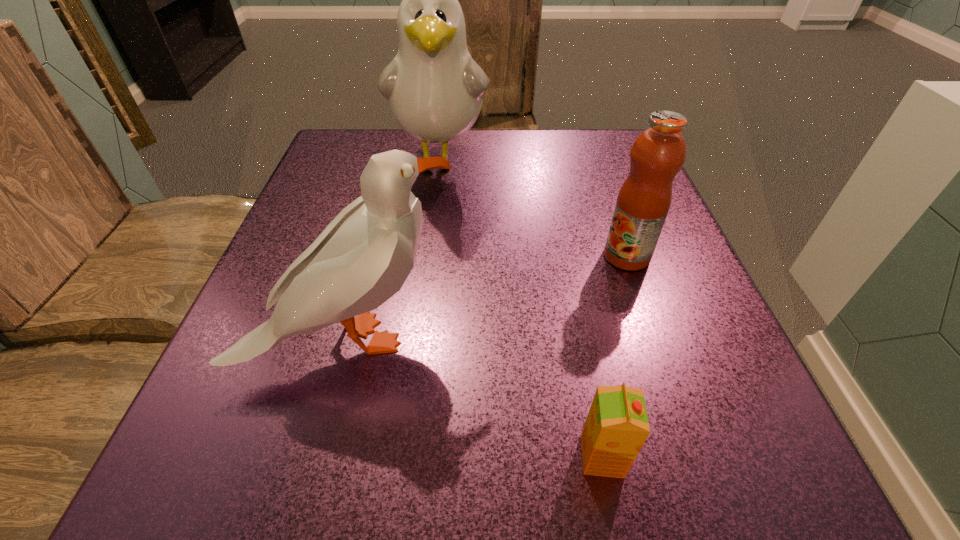
This screenshot has width=960, height=540. Identify the location of the farthest object. (435, 89).

This screenshot has width=960, height=540. In order to click on the farther gull in this screenshot , I will do `click(435, 89)`.

The height and width of the screenshot is (540, 960). In order to click on the shorter gull in this screenshot , I will do `click(363, 257)`.

Locate an element on the screen. The width and height of the screenshot is (960, 540). the nearer gull is located at coordinates pyautogui.click(x=363, y=257).

What are the coordinates of `the third nearest object` in the screenshot? It's located at (658, 153).

This screenshot has height=540, width=960. Identify the location of fruit juice. (658, 153).

At what (x,y) coordinates should I click in order to perform the action: click on the nearest object. Please return your answer as a coordinate pair (x, y). The height and width of the screenshot is (540, 960). Looking at the image, I should click on (616, 428).

You are a GUI agent. You are given a task and a screenshot of the screen. Output one action in this format:
    pyautogui.click(x=<x>, y=<y>)
    Task: Click on the shortest object
    
    Given the screenshot: What is the action you would take?
    (x=616, y=428)

What are the coordinates of `free space located on the beak of the farthest object` in the screenshot? It's located at (431, 234).

At what (x,y) coordinates should I click in order to perform the action: click on vacant space situated 0.230m at the beak of the third farthest object. Please return your answer as a coordinate pair (x, y). Looking at the image, I should click on (616, 339).